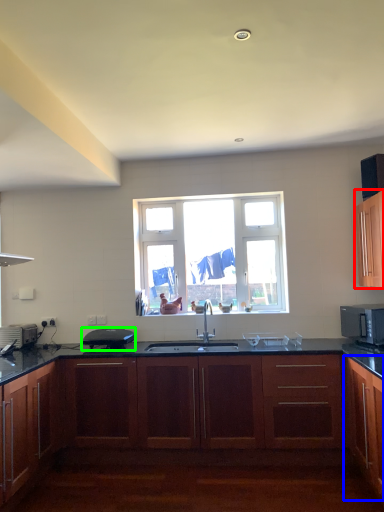
Question: Considering the real-world distances, which object is farthest from cabinetry (highlighted by a red box)? cabinetry (highlighted by a blue box) or appliance (highlighted by a green box)?

Choices:
 (A) cabinetry
 (B) appliance

Answer: (B)